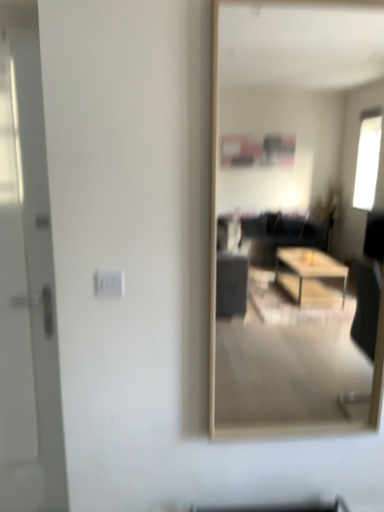
Question: From their relative heights in the image, would you say white glossy door at left is taller or shorter than transparent glass mirror at center?

Choices:
 (A) short
 (B) tall

Answer: (B)

Question: Is white glossy door at left spatially inside transparent glass mirror at center, or outside of it?

Choices:
 (A) outside
 (B) inside

Answer: (A)

Question: Based on their relative distances, which object is farther from the white plastic electric outlet at center?

Choices:
 (A) white glossy door at left
 (B) transparent glass mirror at center

Answer: (B)

Question: Which of these objects is positioned closest to the white glossy door at left?

Choices:
 (A) white plastic electric outlet at center
 (B) transparent glass mirror at center

Answer: (A)